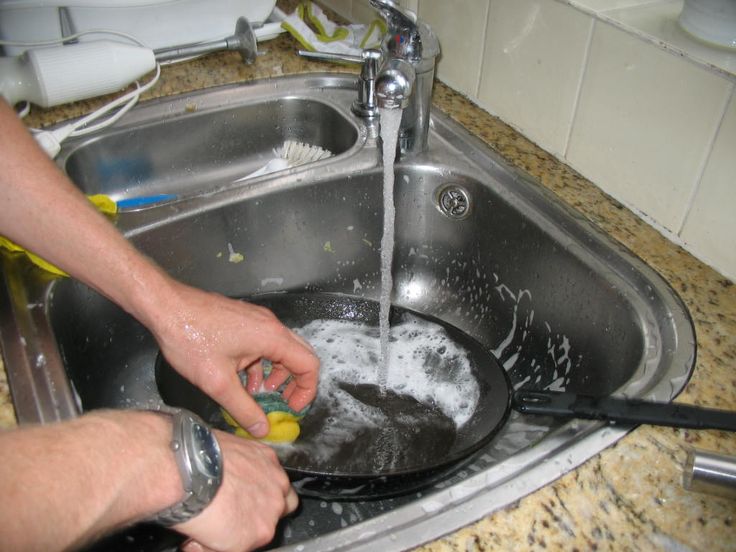
This screenshot has width=736, height=552. I want to click on backsplash, so click(x=662, y=120).